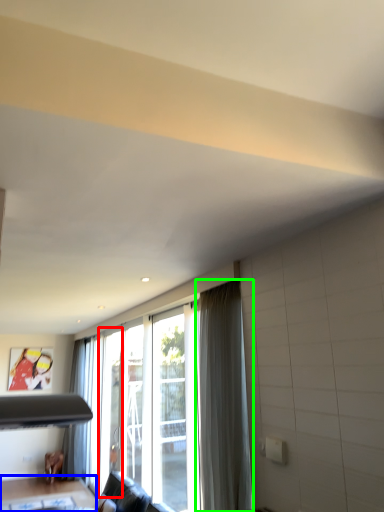
Question: Based on their relative distances, which object is farther from screen door (highlighted by a red box)? Choose from table (highlighted by a blue box) and curtain (highlighted by a green box).

Choices:
 (A) table
 (B) curtain

Answer: (B)